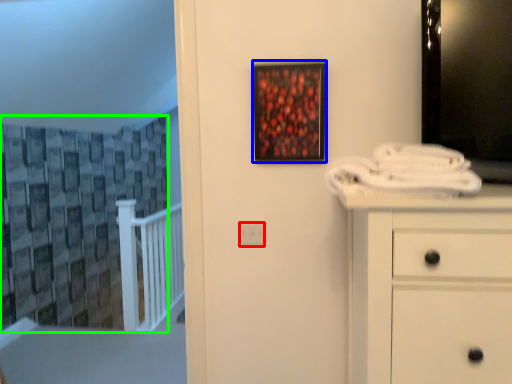
Question: Which object is the closest to the electric outlet (highlighted by a red box)? Choose among these: picture frame (highlighted by a blue box) or curtain (highlighted by a green box).

Choices:
 (A) picture frame
 (B) curtain

Answer: (A)